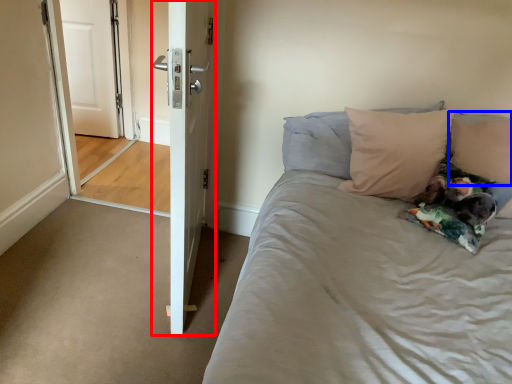
Question: Among these objects, which one is farthest to the camera, door (highlighted by a red box) or pillow (highlighted by a blue box)?

Choices:
 (A) door
 (B) pillow

Answer: (B)